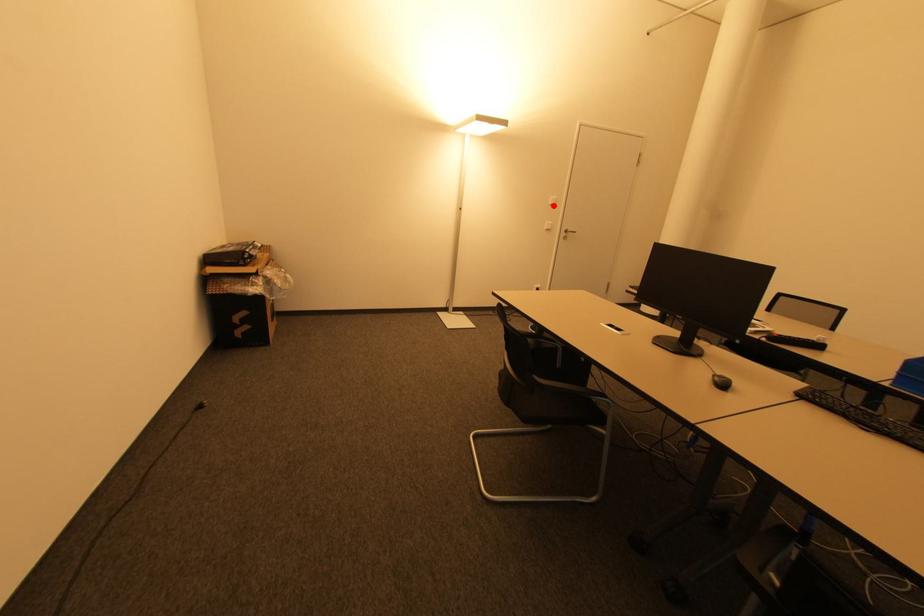
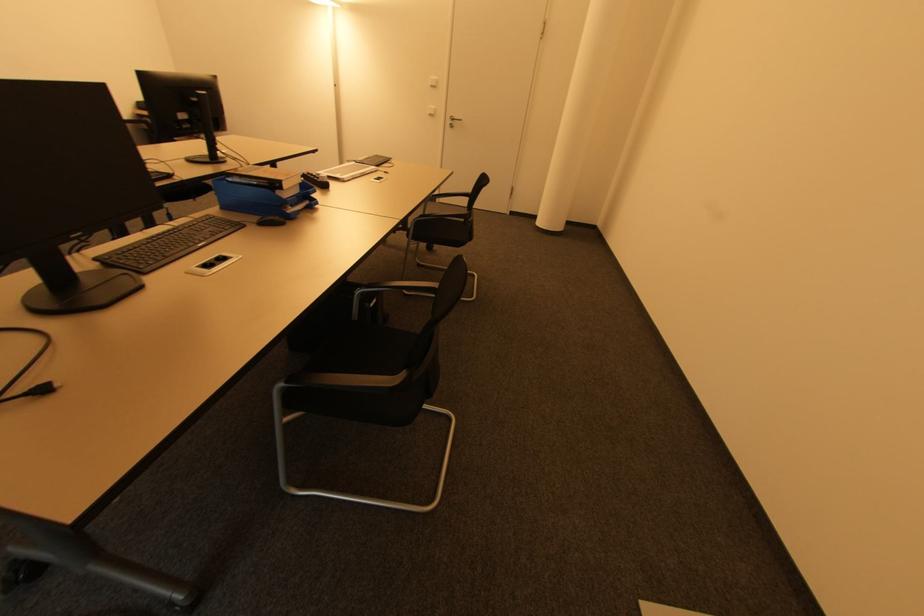
The point at the highlighted location is marked in the first image. Where is the corresponding point in the second image?

(434, 87)